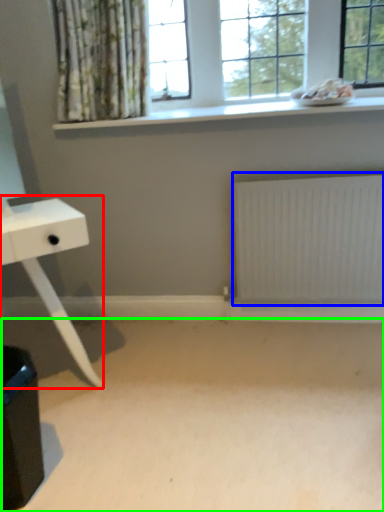
Question: Which object is positioned farthest from table (highlighted by a red box)? Select from radiator (highlighted by a blue box) and plain (highlighted by a green box).

Choices:
 (A) radiator
 (B) plain

Answer: (A)